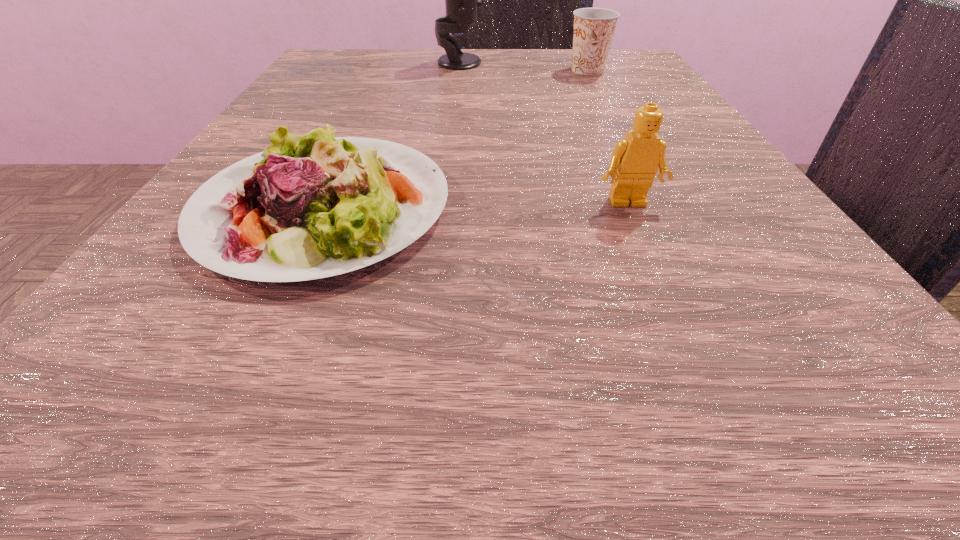
Locate an element on the screen. This screenshot has height=540, width=960. the tallest object is located at coordinates (462, 0).

The width and height of the screenshot is (960, 540). I want to click on Lego, so click(635, 160).

This screenshot has height=540, width=960. What are the coordinates of `the third tallest object` in the screenshot? It's located at (594, 28).

Find the location of `salad plate`. salad plate is located at coordinates (346, 202).

Find the location of a particular element. This screenshot has width=960, height=540. free space located 0.210m on the right of the microphone is located at coordinates (588, 63).

In order to click on vacant space located 0.080m on the face of the Lego in this screenshot , I will do `click(653, 260)`.

At what (x,y) coordinates should I click in order to perform the action: click on vacant space located on the front of the Dixie cup. Please return your answer as a coordinate pair (x, y). The height and width of the screenshot is (540, 960). Looking at the image, I should click on (624, 140).

The width and height of the screenshot is (960, 540). I want to click on vacant space located on the right of the salad plate, so click(599, 207).

Identify the location of microphone that is at the far edge. The image size is (960, 540). (462, 0).

The height and width of the screenshot is (540, 960). I want to click on Dixie cup that is positioned at the far edge, so click(594, 28).